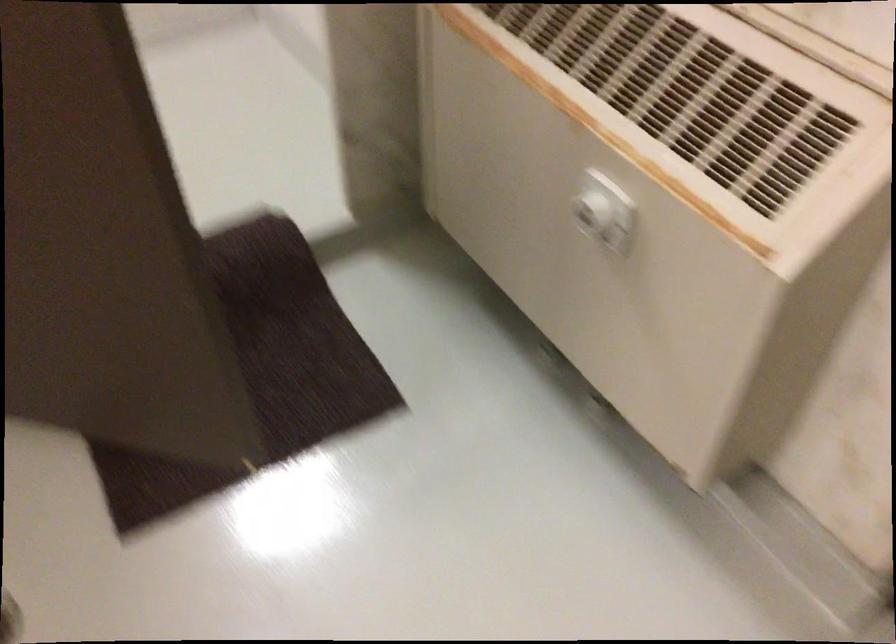
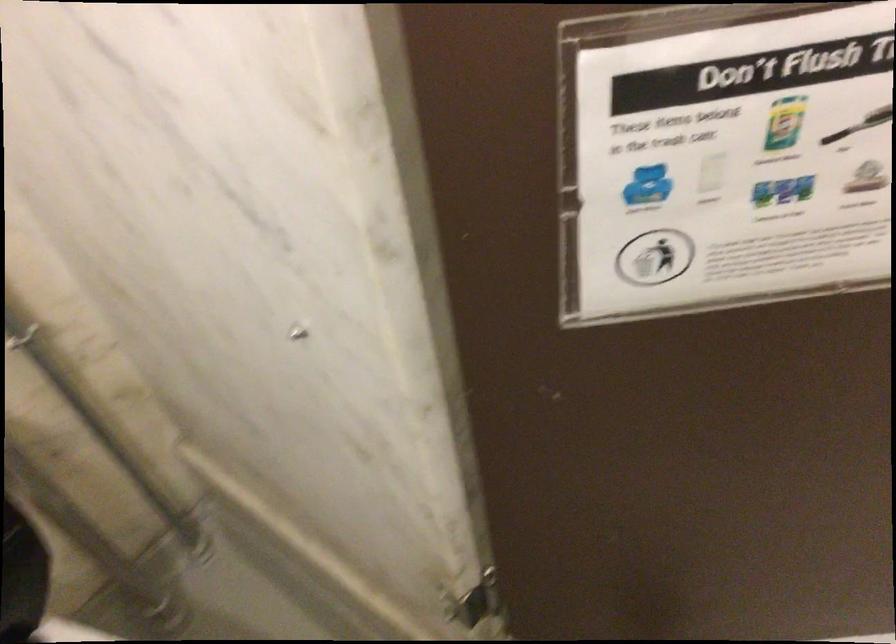
Question: Which direction would the cameraman need to move to produce the second image? Reply with the corresponding letter.

Choices:
 (A) Left
 (B) Right
 (C) Forward
 (D) Backward

Answer: (A)